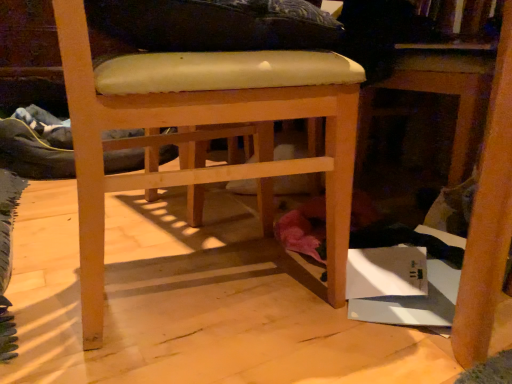
Question: From the image's perspective, is wooden table at lower right located above light brown wood chair at center?

Choices:
 (A) no
 (B) yes

Answer: (B)

Question: Is wooden table at lower right shorter than light brown wood chair at center?

Choices:
 (A) yes
 (B) no

Answer: (A)

Question: Can you confirm if wooden table at lower right is wider than light brown wood chair at center?

Choices:
 (A) yes
 (B) no

Answer: (A)

Question: Does wooden table at lower right appear on the right side of light brown wood chair at center?

Choices:
 (A) no
 (B) yes

Answer: (B)

Question: Is wooden table at lower right far from light brown wood chair at center?

Choices:
 (A) no
 (B) yes

Answer: (A)

Question: Is wooden table at lower right in front of light brown wood chair at center?

Choices:
 (A) no
 (B) yes

Answer: (A)

Question: Can you confirm if light brown wood chair at center is taller than wooden table at lower right?

Choices:
 (A) yes
 (B) no

Answer: (A)

Question: Is light brown wood chair at center thinner than wooden table at lower right?

Choices:
 (A) yes
 (B) no

Answer: (A)

Question: Is light brown wood chair at center far from wooden table at lower right?

Choices:
 (A) yes
 (B) no

Answer: (B)

Question: Is light brown wood chair at center with wooden table at lower right?

Choices:
 (A) no
 (B) yes

Answer: (A)

Question: From the image's perspective, is light brown wood chair at center located above wooden table at lower right?

Choices:
 (A) no
 (B) yes

Answer: (A)

Question: Is light brown wood chair at center positioned with its back to wooden table at lower right?

Choices:
 (A) no
 (B) yes

Answer: (A)

Question: From the image's perspective, is wooden table at lower right located above or below light brown wood chair at center?

Choices:
 (A) below
 (B) above

Answer: (B)